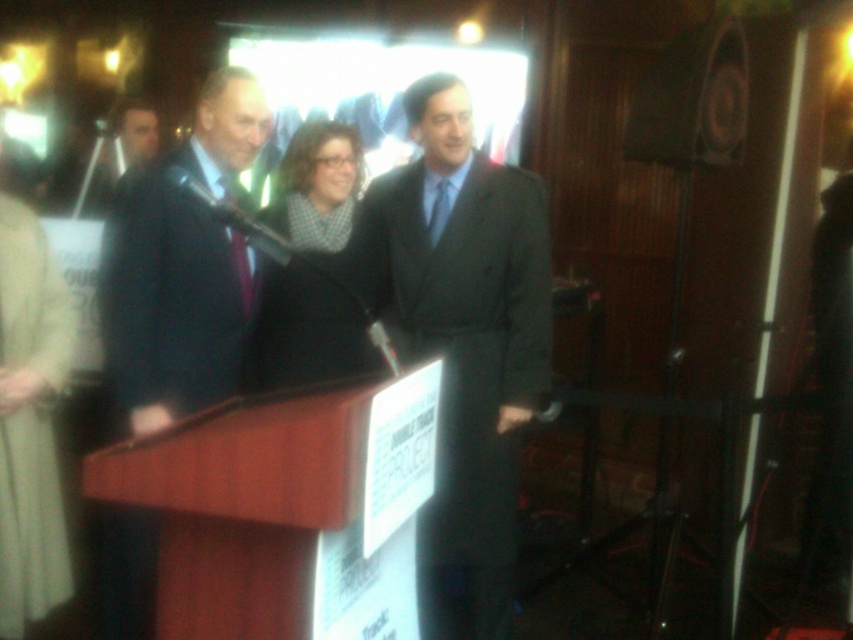
Question: Is dark gray suit at center above matte black suit at center?

Choices:
 (A) no
 (B) yes

Answer: (A)

Question: Which object is closer to the camera taking this photo?

Choices:
 (A) dark gray suit at center
 (B) matte black suit at center
 (C) black wool scarf at center
 (D) matte black speaker at upper right

Answer: (B)

Question: Which point appears closest to the camera in this image?

Choices:
 (A) (267, 323)
 (B) (107, 598)
 (C) (730, 19)

Answer: (B)

Question: Which is nearer to the black wool scarf at center?

Choices:
 (A) matte black speaker at upper right
 (B) dark gray suit at center

Answer: (B)

Question: Can you confirm if black wool scarf at center is positioned to the left of matte black speaker at upper right?

Choices:
 (A) yes
 (B) no

Answer: (A)

Question: Can you confirm if matte black suit at center is positioned below matte black speaker at upper right?

Choices:
 (A) yes
 (B) no

Answer: (A)